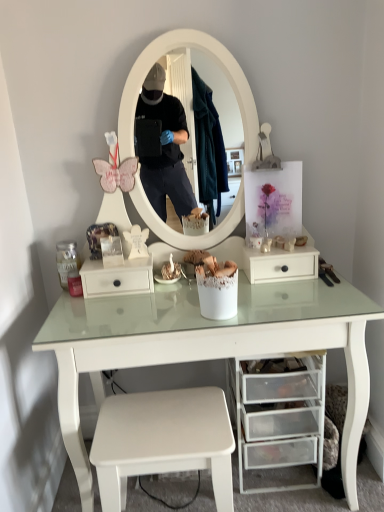
You are a GUI agent. You are given a task and a screenshot of the screen. Output one action in this format:
    pyautogui.click(x=<x>, y=<y>)
    Task: Click on the vacant point above white matte stool at lower center (from a real-world perspective)
    Image resolution: width=384 pixels, height=512 pixels.
    Given the screenshot: What is the action you would take?
    pyautogui.click(x=162, y=421)